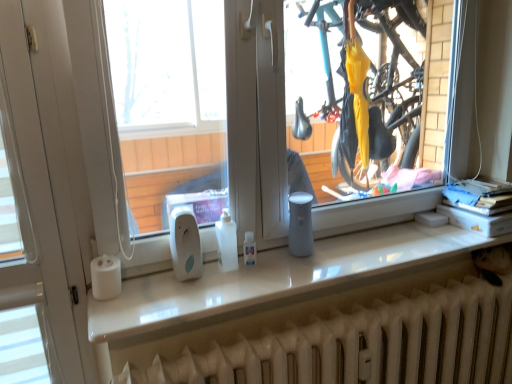
At what (x,y) coordinates should I click in order to perform the action: click on vacant space to the right of white matte paper towel at left. Please return your answer as a coordinate pair (x, y). Looking at the image, I should click on (154, 295).